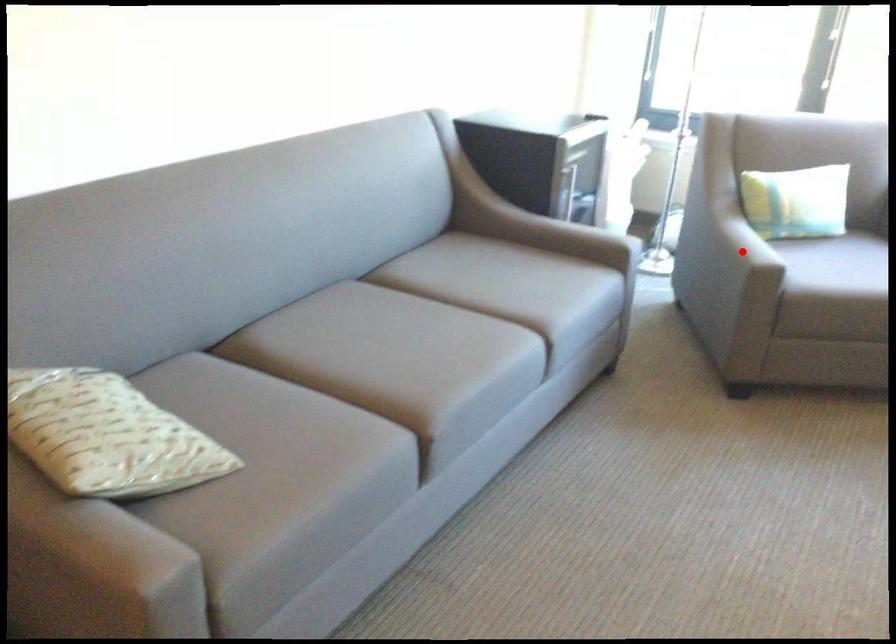
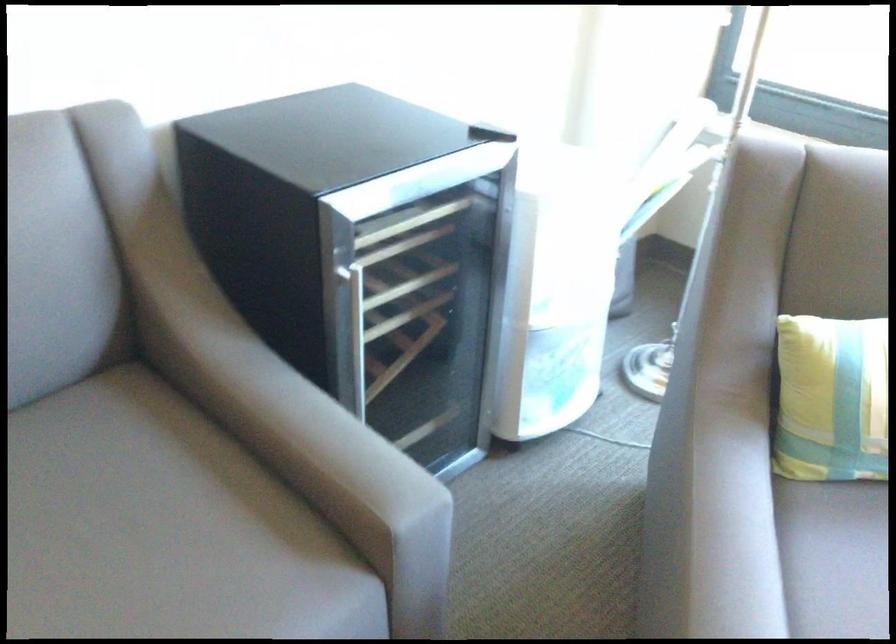
Question: I am providing you with two images of the same scene from different viewpoints. Image1 has a red point marked. In image2, the corresponding 3D location appears at what relative position? Reply with the corresponding letter.

Choices:
 (A) Closer
 (B) Farther

Answer: (A)